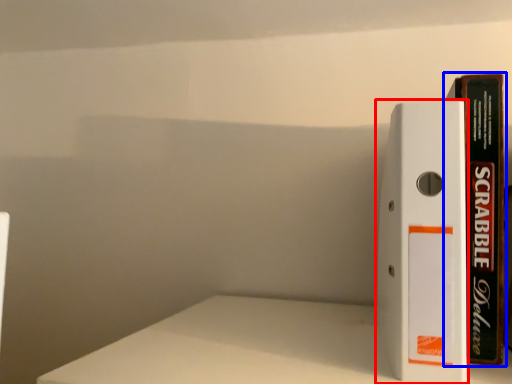
Question: Which of the following is the farthest to the observer, book (highlighted by a red box) or book (highlighted by a blue box)?

Choices:
 (A) book
 (B) book

Answer: (B)